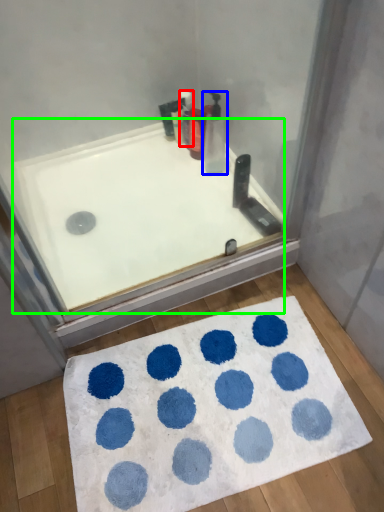
Question: Which object is the farthest from cleaning product (highlighted by a red box)? Choose among these: cleaning product (highlighted by a blue box) or bathtub (highlighted by a green box).

Choices:
 (A) cleaning product
 (B) bathtub

Answer: (B)